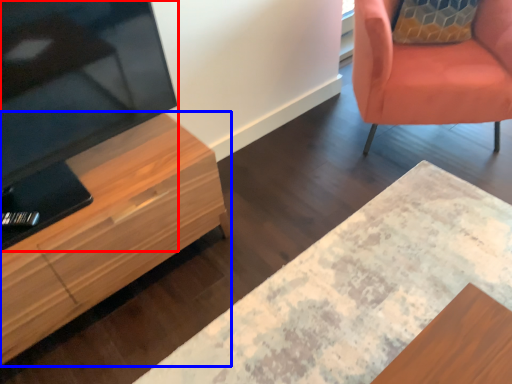
Question: Which point is closer to the camera, television (highlighted by a red box) or cabinetry (highlighted by a blue box)?

Choices:
 (A) television
 (B) cabinetry

Answer: (A)